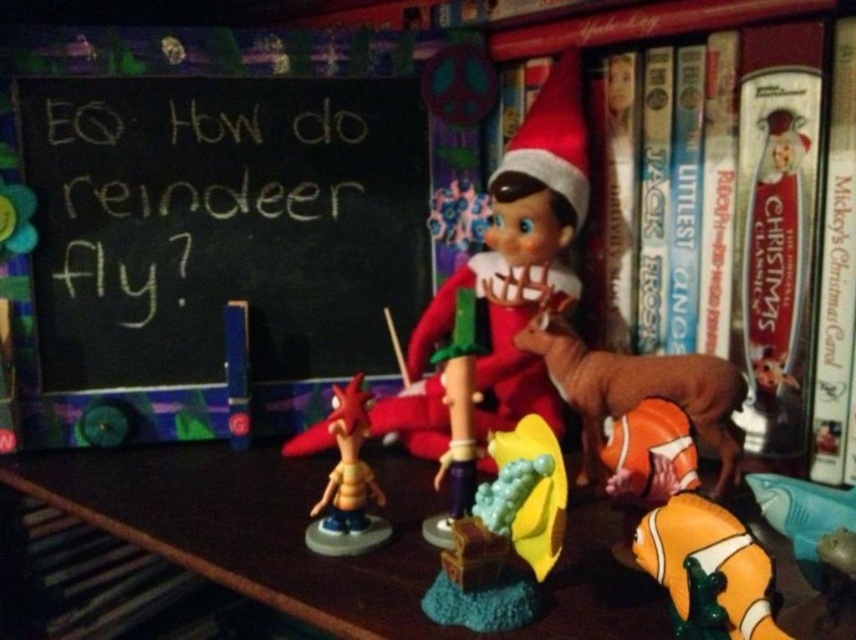
You are standing in front of the festive shelf display and want to place a gift box that is 20 inches long on the wooden table at center. Can the gift box fit on the table?

The wooden table at center is 21.08 inches from viewer, so the gift box that is 20 inches long can fit on the table since it is shorter than the table length.